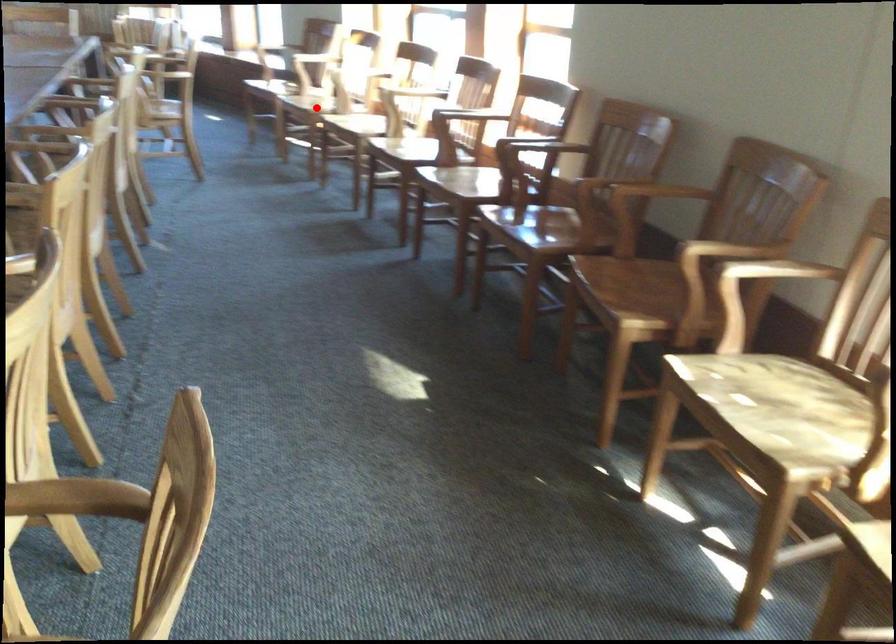
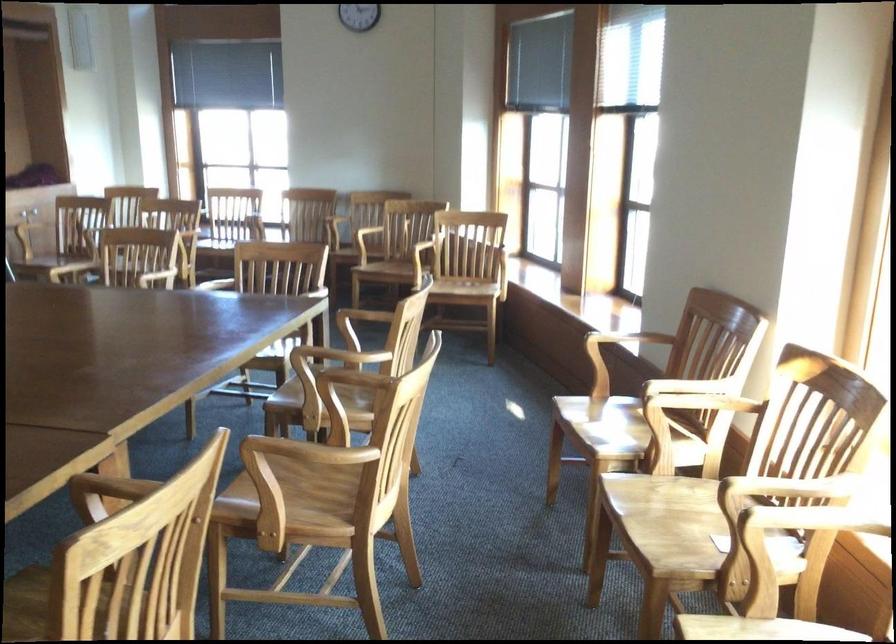
Question: I am providing you with two images of the same scene from different viewpoints. Given a red point in image1, look at the same physical point in image2. Is it:

Choices:
 (A) Closer to the viewpoint
 (B) Farther from the viewpoint

Answer: (A)